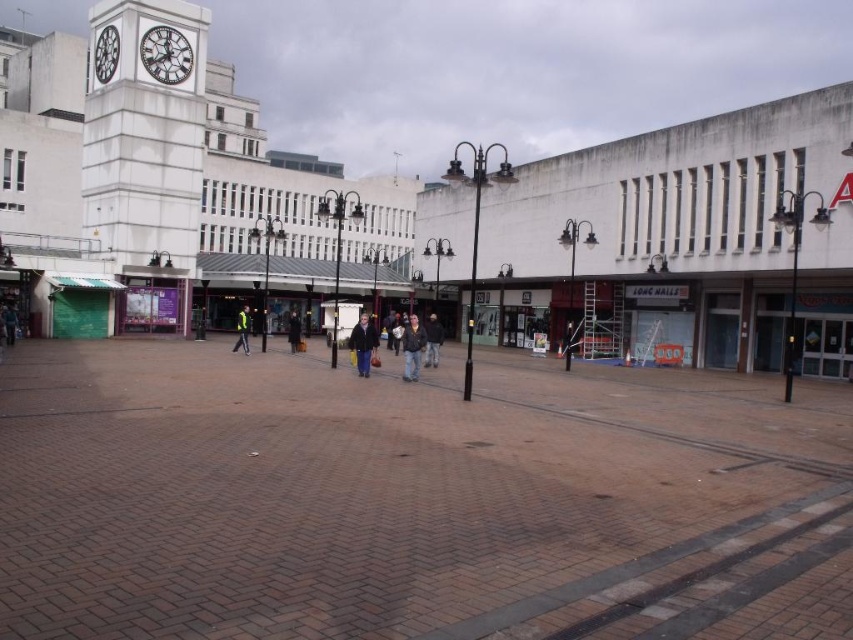
Question: Does dark gray jacket at center have a greater width compared to dark brown leather jacket at center?

Choices:
 (A) no
 (B) yes

Answer: (B)

Question: Does dark blue jacket at center come behind reflective yellow jacket at center?

Choices:
 (A) yes
 (B) no

Answer: (B)

Question: Is dark blue jacket at center positioned at the back of dark gray jacket at center?

Choices:
 (A) no
 (B) yes

Answer: (B)

Question: Which point is closer to the camera taking this photo?

Choices:
 (A) (245, 324)
 (B) (103, 28)

Answer: (A)

Question: Which point is closer to the camera taking this photo?

Choices:
 (A) (289, 339)
 (B) (180, 19)
 (C) (412, 333)
 (D) (102, 32)

Answer: (C)

Question: Which point is closer to the camera?

Choices:
 (A) dark blue jacket at center
 (B) dark brown leather coat at center

Answer: (A)